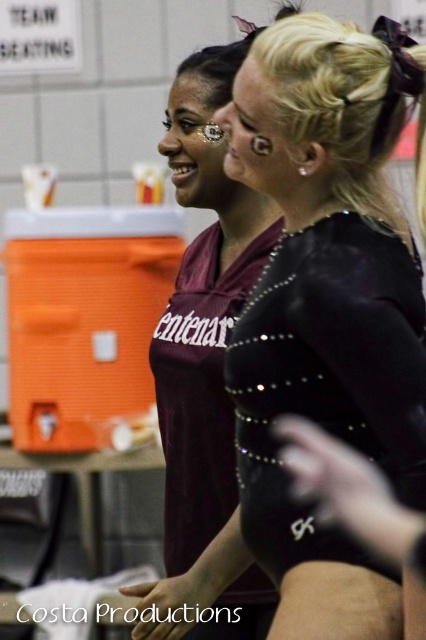
You are a photographer at a sports event. You need to position a spotlight on the black shiny leotard at center and the maroon jersey at center. Since both are at the center, how do you determine which one is on the right side?

The black shiny leotard at center is to the right of the maroon jersey at center, so the spotlight should be placed on the right side of the maroon jersey at center to target the black shiny leotard at center.

You are a photographer at a sports event. You need to capture a photo where both the black shiny leotard at center and the maroon jersey at center are visible. Based on their heights, which one will appear closer to the bottom of the photo?

The black shiny leotard at center is not as tall as the maroon jersey at center, so the black shiny leotard at center will appear closer to the bottom of the photo.